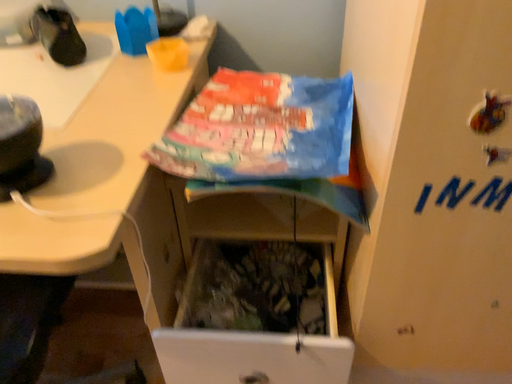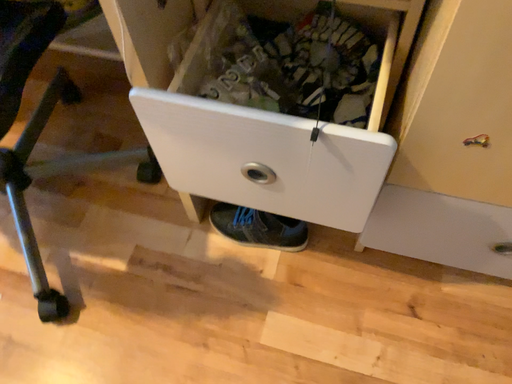
Question: Which way did the camera rotate in the video?

Choices:
 (A) rotated downward
 (B) rotated upward

Answer: (A)